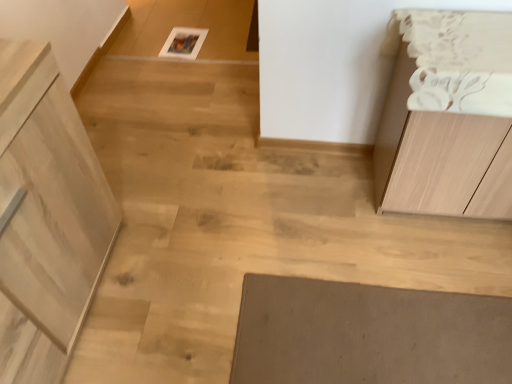
Question: From the image's perspective, relative to light wood cabinet at left, the second cabinetry from the right, is light wood cabinet at right, the 1th cabinetry in the right-to-left sequence, above or below?

Choices:
 (A) below
 (B) above

Answer: (B)

Question: From a real-world perspective, is light wood cabinet at right, the 1th cabinetry in the right-to-left sequence, positioned above or below light wood cabinet at left, the second cabinetry from the right?

Choices:
 (A) below
 (B) above

Answer: (A)

Question: In terms of height, does light wood cabinet at right, positioned as the second cabinetry in left-to-right order, look taller or shorter compared to light wood cabinet at left, which is the 1th cabinetry from left to right?

Choices:
 (A) short
 (B) tall

Answer: (A)

Question: From a real-world perspective, is light wood cabinet at left, which is the 1th cabinetry from left to right, above or below light wood cabinet at right, positioned as the second cabinetry in left-to-right order?

Choices:
 (A) below
 (B) above

Answer: (B)

Question: Looking at their shapes, would you say light wood cabinet at left, the second cabinetry from the right, is wider or thinner than light wood cabinet at right, positioned as the second cabinetry in left-to-right order?

Choices:
 (A) thin
 (B) wide

Answer: (B)

Question: Considering their positions, is light wood cabinet at left, which is the 1th cabinetry from left to right, located in front of or behind light wood cabinet at right, the 1th cabinetry in the right-to-left sequence?

Choices:
 (A) front
 (B) behind

Answer: (A)

Question: From the image's perspective, is light wood cabinet at left, the second cabinetry from the right, above or below light wood cabinet at right, the 1th cabinetry in the right-to-left sequence?

Choices:
 (A) above
 (B) below

Answer: (B)